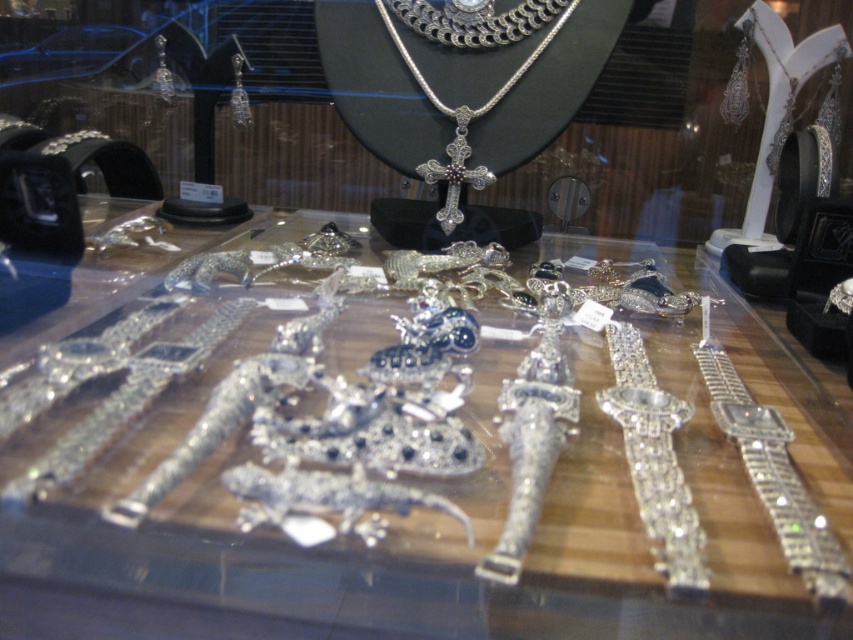
Question: Can you confirm if sparkling silver watch at center is positioned to the right of silver/gemstone cross at center?

Choices:
 (A) yes
 (B) no

Answer: (A)

Question: Which of the following is the farthest from the observer?

Choices:
 (A) (737, 385)
 (B) (471, 32)
 (C) (654, 557)

Answer: (B)

Question: In this image, where is sparkling silver watch at center located relative to shiny silver necklace at center?

Choices:
 (A) left
 (B) right

Answer: (A)

Question: Is sparkling silver watch at center closer to camera compared to silver/gemstone cross at center?

Choices:
 (A) no
 (B) yes

Answer: (B)

Question: Which object is the farthest from the silver/gemstone cross at center?

Choices:
 (A) sparkling silver watch at center
 (B) shiny silver necklace at center

Answer: (B)

Question: Estimate the real-world distances between objects in this image. Which object is farther from the sparkling silver watch at center?

Choices:
 (A) shiny silver necklace at center
 (B) silver/gemstone cross at center

Answer: (B)